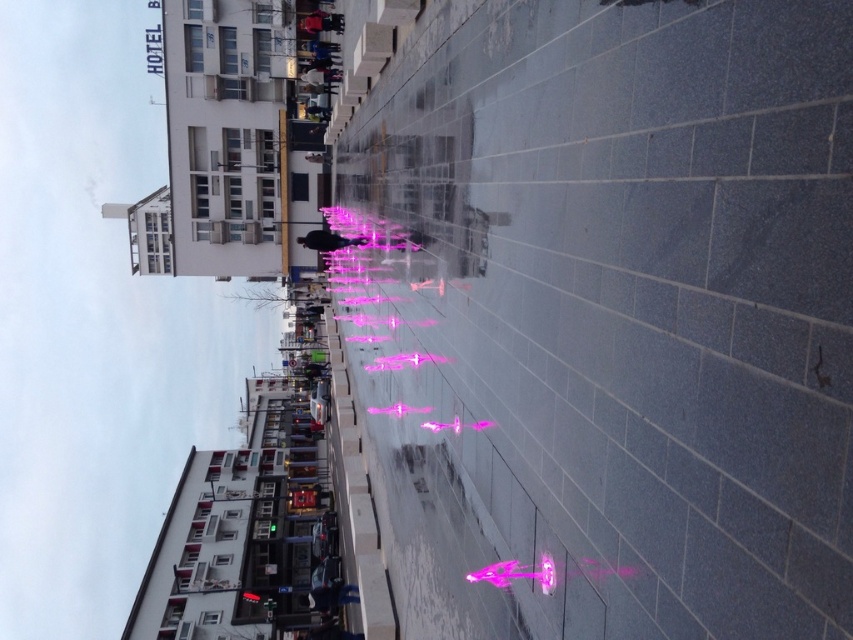
You are standing in the plaza and want to take a photo of the pink glossy fountain at center. If your camera has a maximum focus range of 8 meters, will you need to move closer to get a clear shot?

The pink glossy fountain at center is 8.48 meters from viewer. Since the distance exceeds the camera maximum focus range of 8 meters, you need to move closer to ensure the camera can focus properly.

You are standing at the edge of the plaza and want to take a photo of the pink glossy fountain at center and the matte black person at center. If you want to include both in the frame without moving your camera, which object should you focus on first to ensure both are in focus?

The pink glossy fountain at center is much taller than the matte black person at center, so you should focus on the pink glossy fountain at center first to ensure both are in focus.